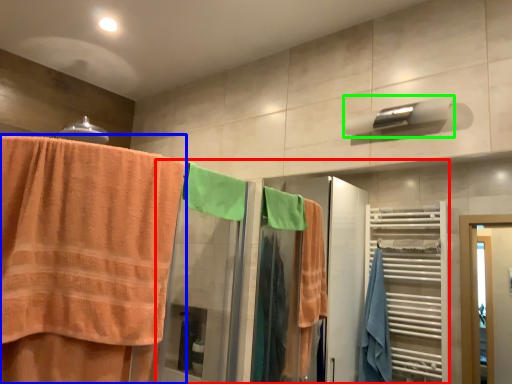
Question: Based on their relative distances, which object is nearer to closet (highlighted by a red box)? Choose from towel (highlighted by a blue box) and towel bar (highlighted by a green box).

Choices:
 (A) towel
 (B) towel bar

Answer: (A)